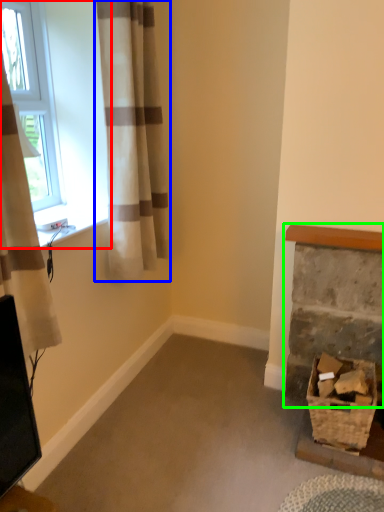
Question: Based on their relative distances, which object is nearer to window (highlighted by a red box)? Choose from curtain (highlighted by a blue box) and fireplace (highlighted by a green box).

Choices:
 (A) curtain
 (B) fireplace

Answer: (A)